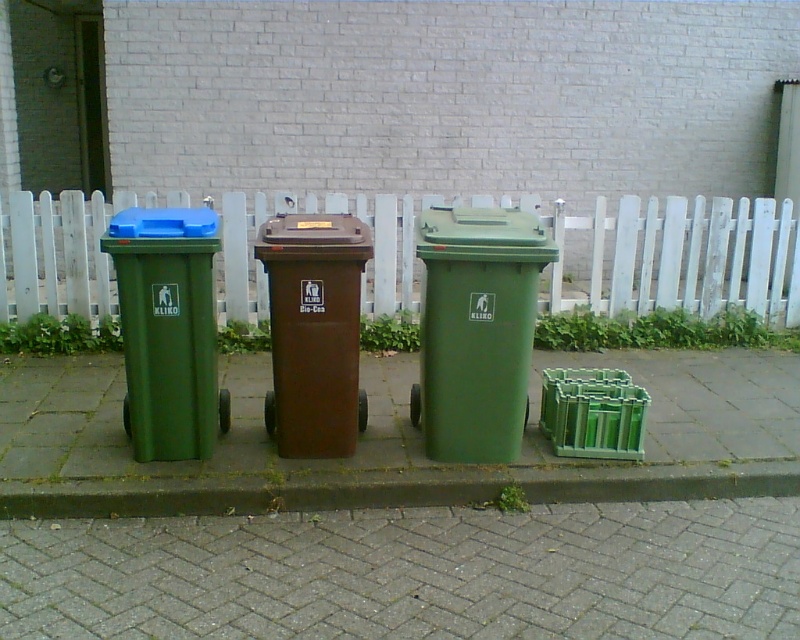
Question: Which object is closer to the camera taking this photo?

Choices:
 (A) green matte plastic recycling bin at left
 (B) gray brick pavement at lower center
 (C) brown matte/recycled plastic at center

Answer: (B)

Question: Which object is closer to the camera taking this photo?

Choices:
 (A) green plastic crate at lower right
 (B) green matte plastic recycling bin at left
 (C) brown matte/recycled plastic at center

Answer: (B)

Question: Is green matte plastic recycling bin at left further to the viewer compared to brown matte/recycled plastic at center?

Choices:
 (A) no
 (B) yes

Answer: (A)

Question: Is white picket fence at center to the right of green plastic recycling bin at center from the viewer's perspective?

Choices:
 (A) no
 (B) yes

Answer: (B)

Question: Among these points, which one is nearest to the camera?

Choices:
 (A) (648, 637)
 (B) (637, 276)
 (C) (614, 392)

Answer: (A)

Question: Observing the image, what is the correct spatial positioning of white picket fence at center in reference to green concrete curb at lower center?

Choices:
 (A) right
 (B) left

Answer: (A)